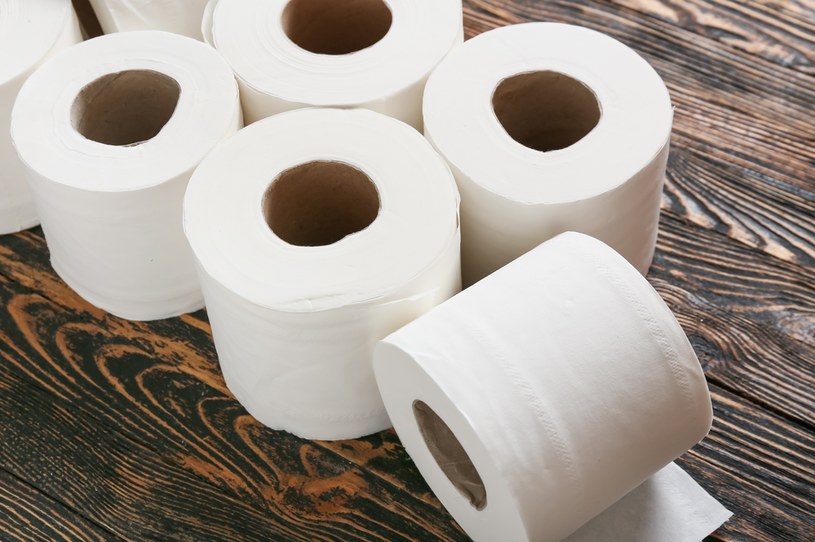
Find the location of a particular element. Image resolution: width=815 pixels, height=542 pixels. toilet paper rolls is located at coordinates (53, 44), (130, 18), (142, 59), (258, 61), (313, 146), (465, 143), (561, 360).